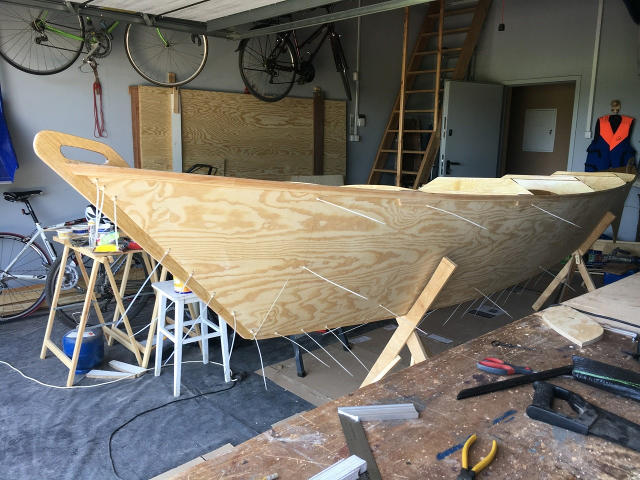
At what (x,y) coordinates should I click in order to perform the action: click on white door. Please return your answer as a coordinate pair (x, y). Image resolution: width=640 pixels, height=480 pixels. Looking at the image, I should click on (486, 129).